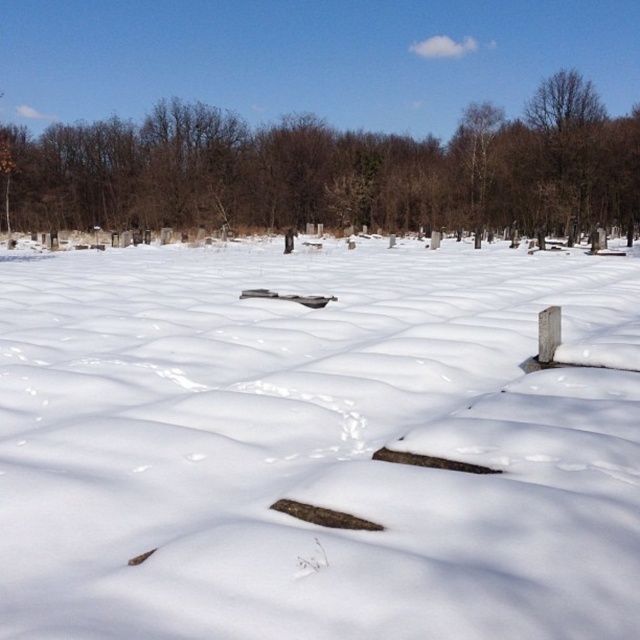
Question: Can you confirm if white fluffy snow at center is positioned above brown wood tree at center?

Choices:
 (A) yes
 (B) no

Answer: (B)

Question: Does white fluffy snow at center have a smaller size compared to brown wood tree at center?

Choices:
 (A) yes
 (B) no

Answer: (A)

Question: Among these objects, which one is nearest to the camera?

Choices:
 (A) white fluffy snow at center
 (B) brown wood tree at center

Answer: (A)

Question: Can you confirm if white fluffy snow at center is positioned to the left of brown wood tree at center?

Choices:
 (A) no
 (B) yes

Answer: (A)

Question: Among these objects, which one is nearest to the camera?

Choices:
 (A) brown wood tree at center
 (B) white fluffy snow at center

Answer: (B)